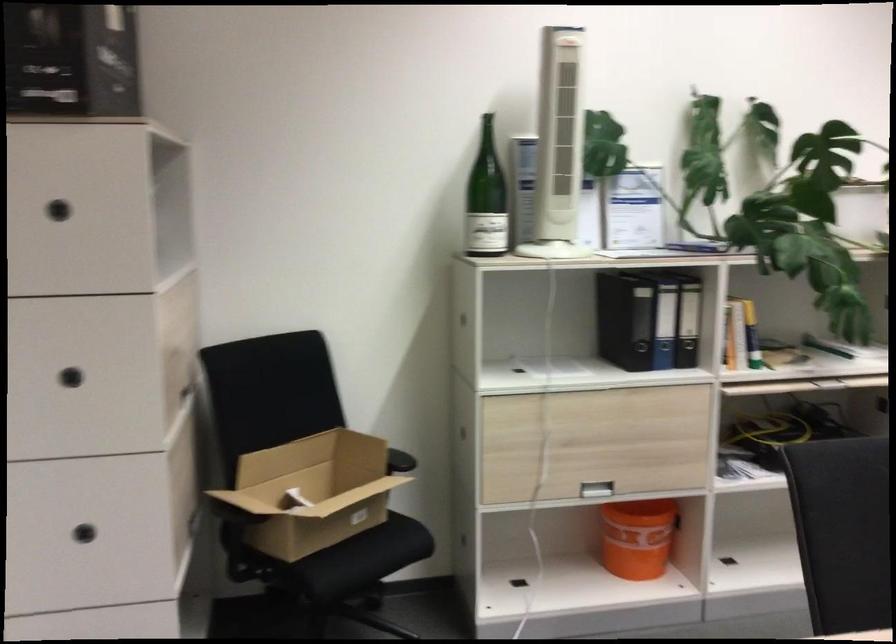
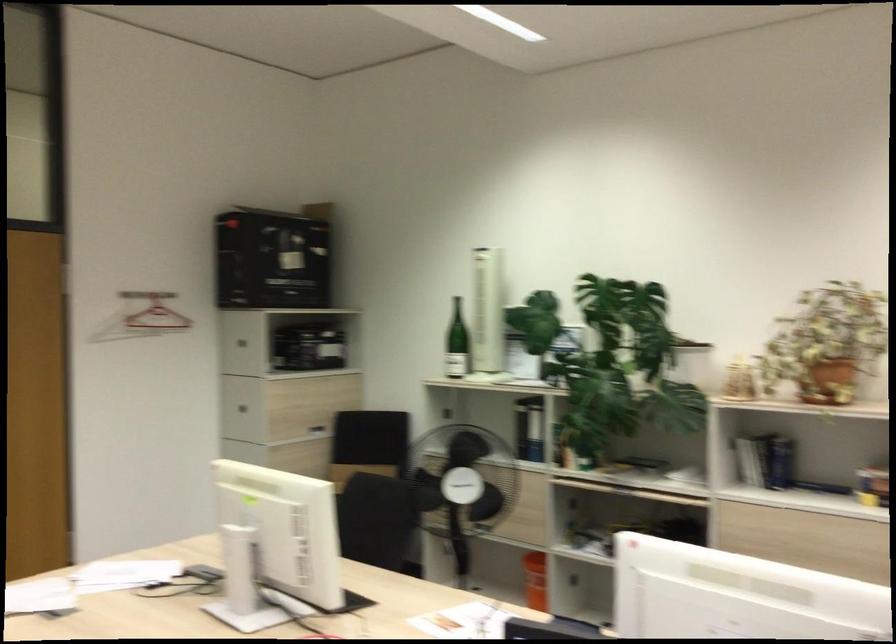
Question: I am providing you with two images of the same scene from different viewpoints. Which of the following objects are not visible in image2?

Choices:
 (A) orange bucket
 (B) black ring binder
 (C) chair sitting surface
 (D) backpack top handle

Answer: (B)